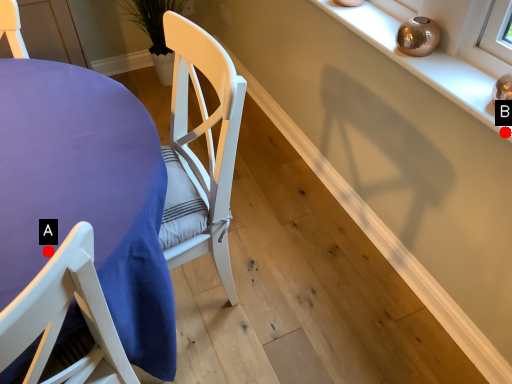
Question: Two points are circled on the image, labeled by A and B beside each circle. Which of the following is the closest to the observer?

Choices:
 (A) A is closer
 (B) B is closer

Answer: (A)